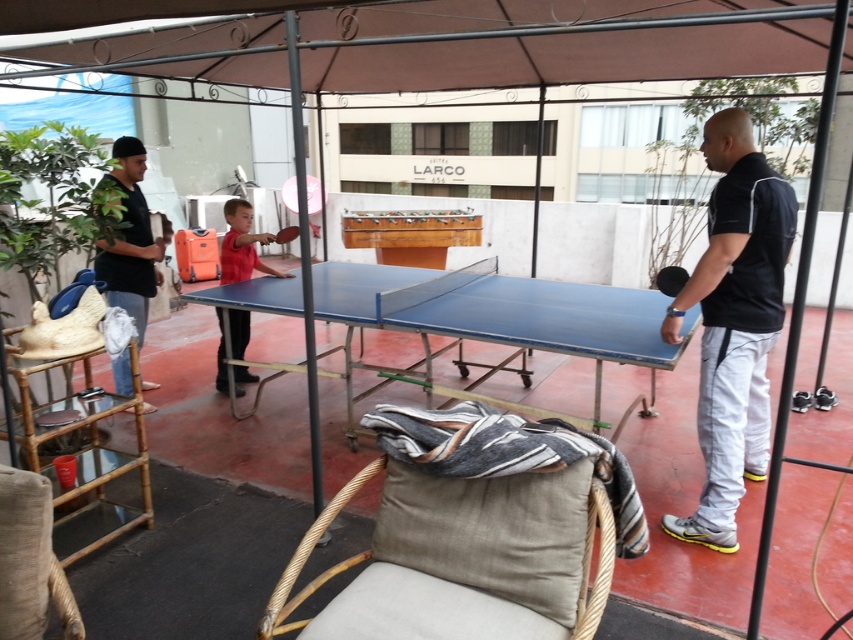
Question: Among these objects, which one is nearest to the camera?

Choices:
 (A) blue rubber table at center
 (B) blue plastic table tennis table at center

Answer: (A)

Question: Can you confirm if beige fabric cushion at lower center is positioned above blue plastic table tennis table at center?

Choices:
 (A) yes
 (B) no

Answer: (B)

Question: Can you confirm if black matte shirt at right is bigger than beige fabric chair at lower left?

Choices:
 (A) no
 (B) yes

Answer: (B)

Question: Is beige fabric cushion at lower center smaller than beige fabric chair at lower left?

Choices:
 (A) no
 (B) yes

Answer: (A)

Question: Which point appears closest to the camera in this image?

Choices:
 (A) (164, 225)
 (B) (18, 481)
 (C) (674, 285)
 (D) (476, 244)

Answer: (B)

Question: Among these objects, which one is nearest to the camera?

Choices:
 (A) beige fabric chair at lower left
 (B) black rubber table tennis table at right

Answer: (A)